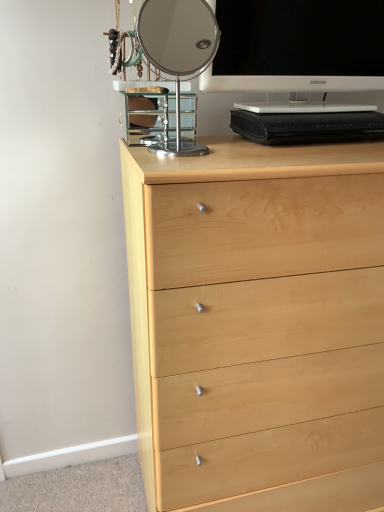
Locate an element on the screen. This screenshot has width=384, height=512. free space in front of polished chrome mirror at upper center is located at coordinates (185, 164).